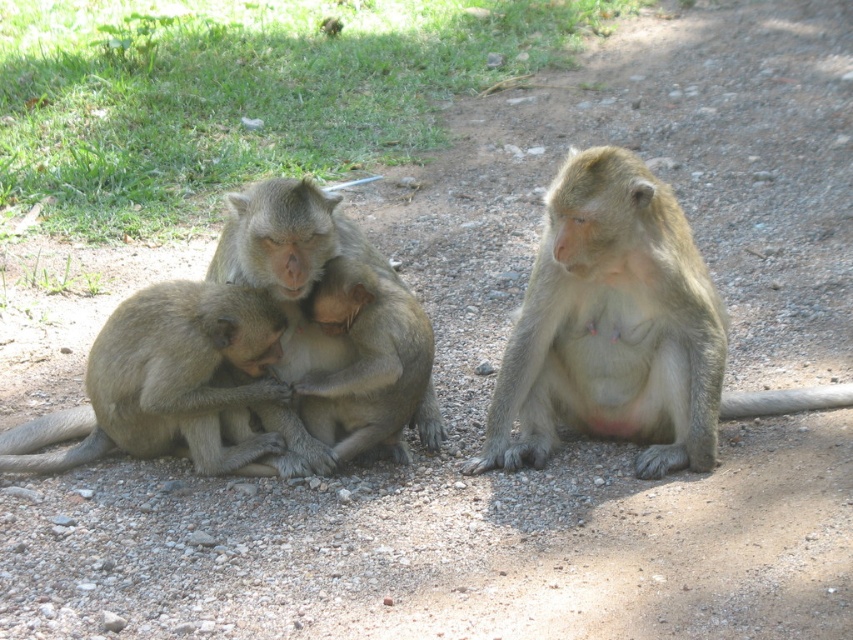
You are standing at the origin point of the image coordinate system. There is a point labeled as point (619, 330). Based on the scene description, what object is located at this coordinate?

The point (619, 330) corresponds to the light brown fur monkey at center.